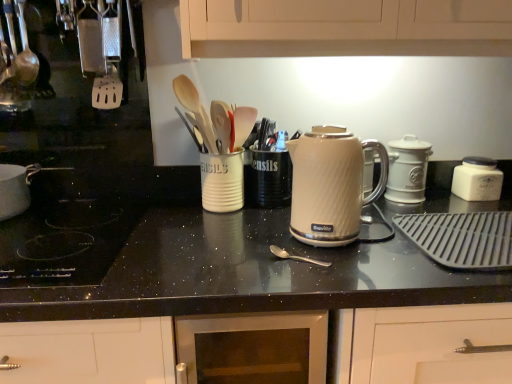
Question: Can you confirm if silver metallic spoon at center, which appears as the 1th utensil when ordered from the bottom, is shorter than cream matte electric kettle at center, which is counted as the first kitchen appliance, starting from the left?

Choices:
 (A) no
 (B) yes

Answer: (B)

Question: Is silver metallic spoon at center, the first utensil when ordered from front to back, wider than cream matte electric kettle at center, arranged as the 3th kitchen appliance when viewed from the back?

Choices:
 (A) yes
 (B) no

Answer: (B)

Question: Is cream matte electric kettle at center, the third kitchen appliance in the right-to-left sequence, a part of silver metallic spoon at center, the 2th utensil viewed from the back?

Choices:
 (A) yes
 (B) no

Answer: (B)

Question: Can you confirm if silver metallic spoon at center, the 2th utensil viewed from the back, is smaller than cream matte electric kettle at center, which is counted as the first kitchen appliance, starting from the left?

Choices:
 (A) yes
 (B) no

Answer: (A)

Question: Is silver metallic spoon at center, which ranks as the 2th utensil in top-to-bottom order, closer to camera compared to cream matte electric kettle at center, arranged as the 3th kitchen appliance when viewed from the back?

Choices:
 (A) no
 (B) yes

Answer: (B)

Question: Relative to black glass cooktop at lower left, is white ceramic container at right, arranged as the 3th kitchen appliance when viewed from the front, in front or behind?

Choices:
 (A) behind
 (B) front

Answer: (A)

Question: From a real-world perspective, is white ceramic container at right, which ranks as the 1th kitchen appliance in right-to-left order, positioned above or below black glass cooktop at lower left?

Choices:
 (A) above
 (B) below

Answer: (A)

Question: In terms of size, does white ceramic container at right, the third kitchen appliance viewed from the left, appear bigger or smaller than black glass cooktop at lower left?

Choices:
 (A) big
 (B) small

Answer: (B)

Question: In terms of height, does white ceramic container at right, the third kitchen appliance viewed from the left, look taller or shorter compared to black glass cooktop at lower left?

Choices:
 (A) short
 (B) tall

Answer: (B)

Question: From a real-world perspective, is white ceramic container at right, the third kitchen appliance viewed from the left, above or below black granite countertop at center?

Choices:
 (A) above
 (B) below

Answer: (A)

Question: From the image's perspective, is white ceramic container at right, the third kitchen appliance viewed from the left, above or below black granite countertop at center?

Choices:
 (A) below
 (B) above

Answer: (B)

Question: Is white ceramic container at right, which ranks as the 1th kitchen appliance in right-to-left order, to the left or to the right of black granite countertop at center in the image?

Choices:
 (A) right
 (B) left

Answer: (A)

Question: In terms of size, does white ceramic container at right, which ranks as the 1th kitchen appliance in right-to-left order, appear bigger or smaller than black granite countertop at center?

Choices:
 (A) small
 (B) big

Answer: (A)

Question: Would you say black granite countertop at center is inside or outside white plastic spatula at left?

Choices:
 (A) inside
 (B) outside

Answer: (B)

Question: Considering the positions of black granite countertop at center and white plastic spatula at left in the image, is black granite countertop at center taller or shorter than white plastic spatula at left?

Choices:
 (A) short
 (B) tall

Answer: (B)